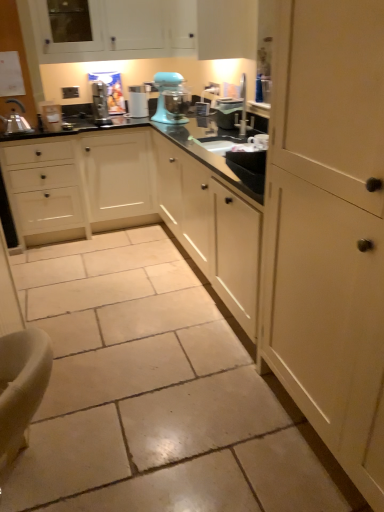
Question: From a real-world perspective, is white plastic coffee machine at center positioned above or below matte cream cabinet at right, which appears as the first cabinetry when viewed from the front?

Choices:
 (A) below
 (B) above

Answer: (B)

Question: Based on their sizes in the image, would you say white plastic coffee machine at center is bigger or smaller than matte cream cabinet at right, the 2th cabinetry from the left?

Choices:
 (A) small
 (B) big

Answer: (A)

Question: Which object is positioned farthest from the white plastic coffee machine at center?

Choices:
 (A) white matte cabinet at upper center, which appears as the second cabinetry when viewed from the front
 (B) metallic silver toaster at center, which ranks as the 1th appliance in right-to-left order
 (C) black glossy countertop at center
 (D) white glossy sink at center
 (E) white plastic toaster at left, the 2th appliance positioned from the right

Answer: (D)

Question: Based on their relative distances, which object is nearer to the metallic silver toaster at center, the 2th appliance when ordered from left to right?

Choices:
 (A) white glossy sink at center
 (B) black glossy countertop at center
 (C) matte cream cabinet at right, which appears as the first cabinetry when viewed from the front
 (D) white plastic toaster at left, the 2th appliance positioned from the right
 (E) white plastic coffee machine at center

Answer: (A)